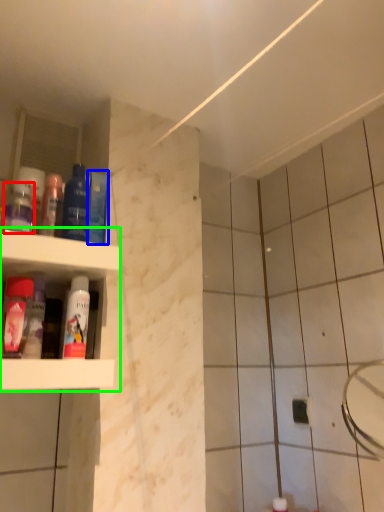
Question: Which object is the farthest from mouthwash (highlighted by a red box)? Choose among these: mouthwash (highlighted by a blue box) or shelf (highlighted by a green box).

Choices:
 (A) mouthwash
 (B) shelf

Answer: (A)